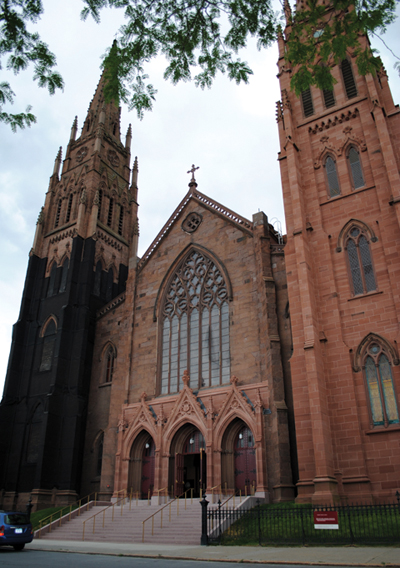
Image resolution: width=400 pixels, height=568 pixels. Identify the location of window. (216, 352).